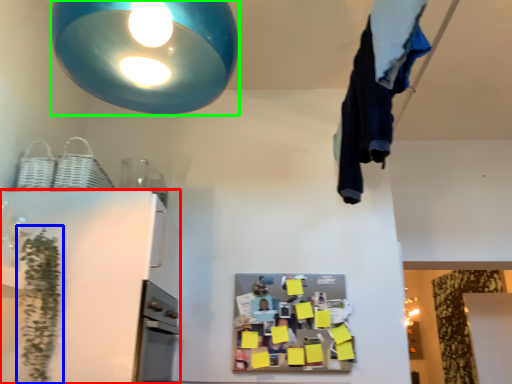
Question: Considering the real-world distances, which object is farthest from appliance (highlighted by a red box)? plant (highlighted by a blue box) or lamp (highlighted by a green box)?

Choices:
 (A) plant
 (B) lamp

Answer: (B)